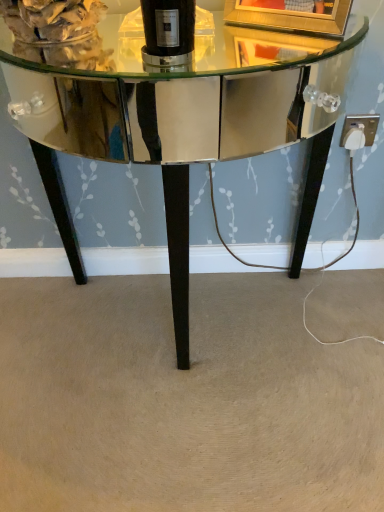
What do you see at coordinates (359, 131) in the screenshot? I see `white plastic outlet at lower right` at bounding box center [359, 131].

What are the coordinates of `gold metallic picture frame at upper center` in the screenshot? It's located at (291, 15).

At what (x,y) coordinates should I click in order to perform the action: click on white plastic outlet at lower right. Please return your answer as a coordinate pair (x, y). The width and height of the screenshot is (384, 512). Looking at the image, I should click on (359, 131).

In the scene shown: Relative to shiny mirrored table at center, is white plastic outlet at lower right in front or behind?

Visually, white plastic outlet at lower right is located behind shiny mirrored table at center.

Considering the sizes of white plastic outlet at lower right and shiny mirrored table at center in the image, is white plastic outlet at lower right taller or shorter than shiny mirrored table at center?

Considering their sizes, white plastic outlet at lower right has less height than shiny mirrored table at center.

Image resolution: width=384 pixels, height=512 pixels. There is a shiny mirrored table at center. What are the coordinates of `electric outlet above it (from a real-world perspective)` in the screenshot? It's located at (359, 131).

Who is bigger, white plastic outlet at lower right or shiny mirrored table at center?

Bigger between the two is shiny mirrored table at center.

Image resolution: width=384 pixels, height=512 pixels. In order to click on electric outlet on the right of black glass bottle at center in this screenshot , I will do `click(359, 131)`.

Is white plastic outlet at lower right positioned beyond the bounds of black glass bottle at center?

Yes.

Does white plastic outlet at lower right have a larger size compared to black glass bottle at center?

Actually, white plastic outlet at lower right might be smaller than black glass bottle at center.

Can you see black glass bottle at center touching shiny mirrored table at center?

No.

Is black glass bottle at center to the right of shiny mirrored table at center from the viewer's perspective?

Indeed, black glass bottle at center is positioned on the right side of shiny mirrored table at center.

From the picture: Considering the sizes of black glass bottle at center and shiny mirrored table at center in the image, is black glass bottle at center bigger or smaller than shiny mirrored table at center?

In the image, black glass bottle at center appears to be smaller than shiny mirrored table at center.

From the picture: Between black glass bottle at center and shiny mirrored table at center, which one has more height?

shiny mirrored table at center is taller.

Between gold metallic picture frame at upper center and white plastic outlet at lower right, which one has larger size?

Bigger between the two is gold metallic picture frame at upper center.

From a real-world perspective, is gold metallic picture frame at upper center physically below white plastic outlet at lower right?

Incorrect, from a real-world perspective, gold metallic picture frame at upper center is higher than white plastic outlet at lower right.

From the image's perspective, does gold metallic picture frame at upper center appear higher than white plastic outlet at lower right?

Yes, from the image's perspective, gold metallic picture frame at upper center is on top of white plastic outlet at lower right.

Can you confirm if gold metallic picture frame at upper center is taller than white plastic outlet at lower right?

Yes.

Is shiny mirrored table at center inside or outside of gold metallic picture frame at upper center?

The correct answer is: outside.

Is shiny mirrored table at center facing towards gold metallic picture frame at upper center?

No.

Is shiny mirrored table at center next to gold metallic picture frame at upper center?

They are not placed beside each other.

From a real-world perspective, between shiny mirrored table at center and gold metallic picture frame at upper center, who is vertically higher?

In real-world perspective, gold metallic picture frame at upper center is above.

Considering the sizes of objects white plastic outlet at lower right and gold metallic picture frame at upper center in the image provided, who is smaller, white plastic outlet at lower right or gold metallic picture frame at upper center?

white plastic outlet at lower right.

Can you confirm if white plastic outlet at lower right is positioned to the left of gold metallic picture frame at upper center?

No, white plastic outlet at lower right is not to the left of gold metallic picture frame at upper center.

Considering the relative positions of white plastic outlet at lower right and gold metallic picture frame at upper center in the image provided, is white plastic outlet at lower right behind gold metallic picture frame at upper center?

Yes, white plastic outlet at lower right is further from the viewer.

Measure the distance between white plastic outlet at lower right and gold metallic picture frame at upper center.

white plastic outlet at lower right is 15.79 inches from gold metallic picture frame at upper center.

Is gold metallic picture frame at upper center turned away from shiny mirrored table at center?

gold metallic picture frame at upper center is not turned away from shiny mirrored table at center.

Would you say gold metallic picture frame at upper center is outside shiny mirrored table at center?

gold metallic picture frame at upper center lies outside shiny mirrored table at center's area.

Between gold metallic picture frame at upper center and shiny mirrored table at center, which one has smaller size?

Smaller between the two is gold metallic picture frame at upper center.

Where is `electric outlet behind the shiny mirrored table at center`? This screenshot has height=512, width=384. electric outlet behind the shiny mirrored table at center is located at coordinates (359, 131).

This screenshot has height=512, width=384. Identify the location of electric outlet on the right of black glass bottle at center. (359, 131).

Which object lies further to the anchor point white plastic outlet at lower right, gold metallic picture frame at upper center or shiny mirrored table at center?

shiny mirrored table at center.

Looking at this image, from the image, which object appears to be nearer to gold metallic picture frame at upper center, white plastic outlet at lower right or black glass bottle at center?

black glass bottle at center is closer to gold metallic picture frame at upper center.

From the image, which object appears to be farther from white plastic outlet at lower right, black glass bottle at center or gold metallic picture frame at upper center?

Among the two, black glass bottle at center is located further to white plastic outlet at lower right.

Looking at the image, which one is located further to black glass bottle at center, gold metallic picture frame at upper center or white plastic outlet at lower right?

The object further to black glass bottle at center is white plastic outlet at lower right.

Which object lies further to the anchor point gold metallic picture frame at upper center, black glass bottle at center or shiny mirrored table at center?

shiny mirrored table at center lies further to gold metallic picture frame at upper center than the other object.

Considering their positions, is shiny mirrored table at center positioned closer to black glass bottle at center than white plastic outlet at lower right?

Among the two, white plastic outlet at lower right is located nearer to black glass bottle at center.

Considering their positions, is white plastic outlet at lower right positioned further to black glass bottle at center than shiny mirrored table at center?

shiny mirrored table at center is further to black glass bottle at center.

From the image, which object appears to be nearer to white plastic outlet at lower right, shiny mirrored table at center or black glass bottle at center?

black glass bottle at center is positioned closer to the anchor white plastic outlet at lower right.

Find the location of a particular element. picture frame between black glass bottle at center and white plastic outlet at lower right along the z-axis is located at coordinates (291, 15).

Locate an element on the screen. bottle between gold metallic picture frame at upper center and shiny mirrored table at center in the vertical direction is located at coordinates (168, 33).

You are a GUI agent. You are given a task and a screenshot of the screen. Output one action in this format:
    pyautogui.click(x=<x>, y=<y>)
    Task: Click on the bottle positioned between shiny mirrored table at center and white plastic outlet at lower right from near to far
    The image size is (384, 512).
    Given the screenshot: What is the action you would take?
    pyautogui.click(x=168, y=33)

At what (x,y) coordinates should I click in order to perform the action: click on picture frame positioned between shiny mirrored table at center and white plastic outlet at lower right from near to far. Please return your answer as a coordinate pair (x, y). The width and height of the screenshot is (384, 512). Looking at the image, I should click on (291, 15).